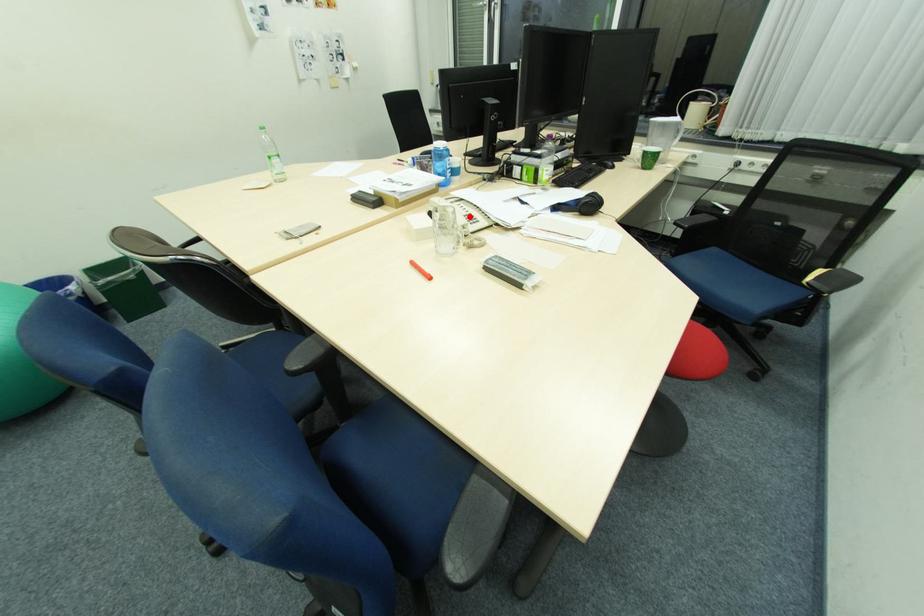
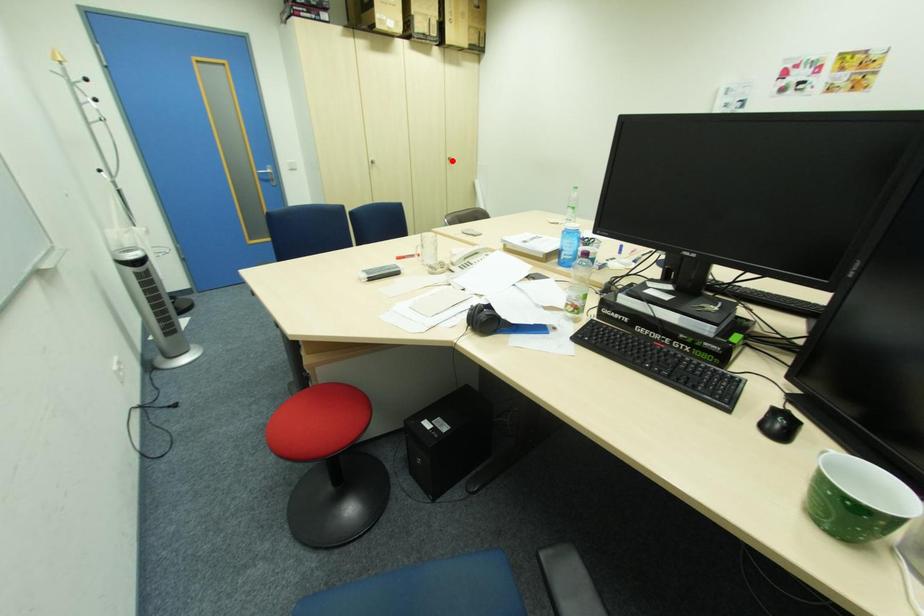
I am providing you with two images of the same scene from different viewpoints. A red point is marked on the first image and another point is marked on the second image. Do the highlighted points in image1 and image2 indicate the same real-world spot?

No